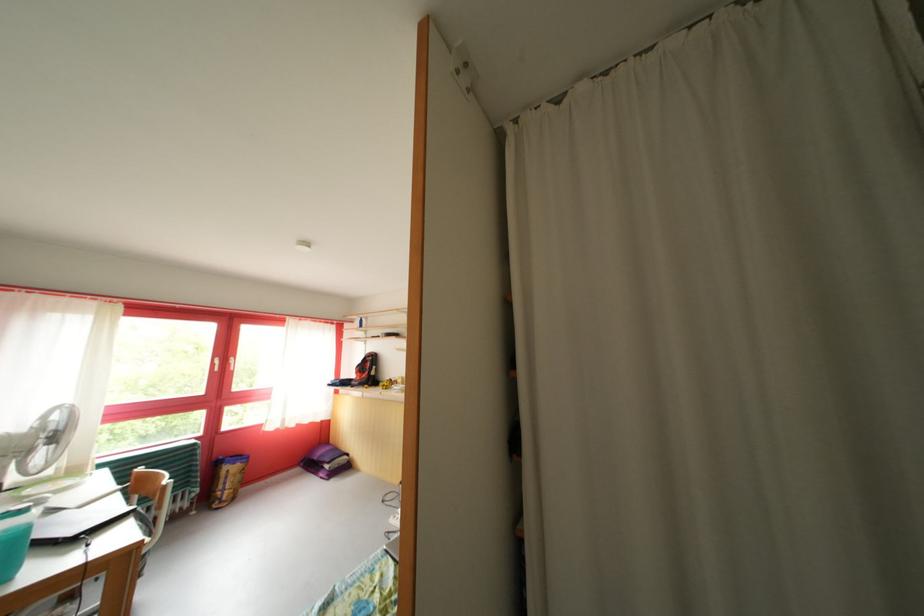
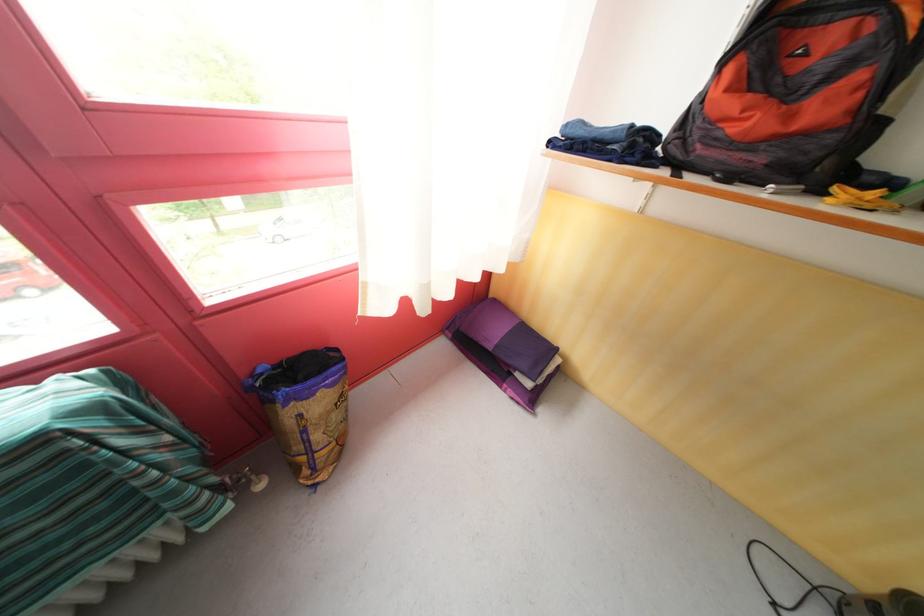
Where in the second image is the point corresponding to (x=363, y=387) from the first image?

(736, 151)